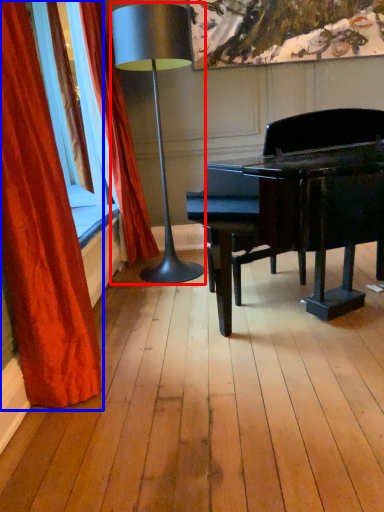
Question: Which object appears farthest to the camera in this image, lamp (highlighted by a red box) or curtain (highlighted by a blue box)?

Choices:
 (A) lamp
 (B) curtain

Answer: (A)